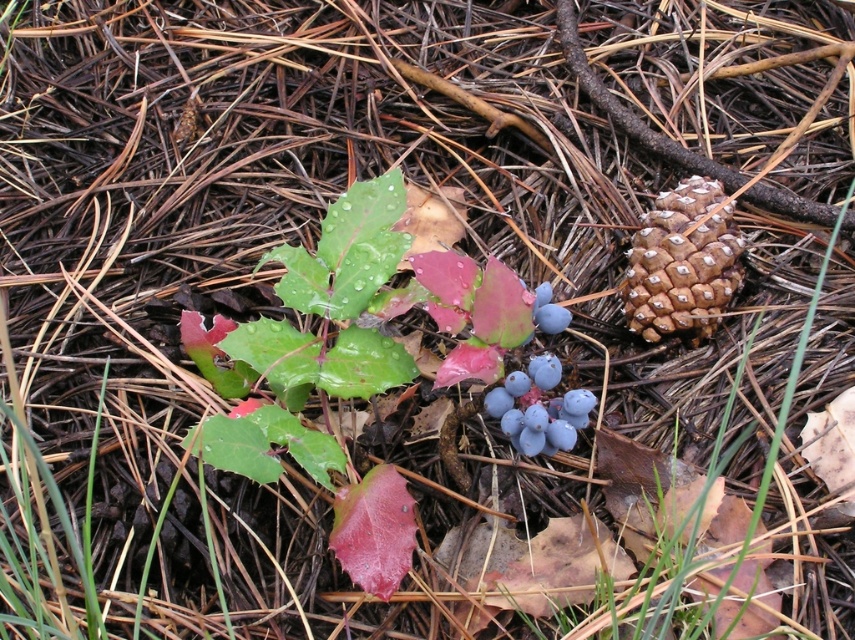
You are a photographer setting up a tripod in the forest. You want to place your camera so that both point (693,225) and point (575,420) are in focus. Which point should you focus on to ensure both are sharp?

You should focus on point (575,420) because it is closer to the camera, and focusing on the closer point will ensure the further point (693,225) is also in focus due to depth of field.